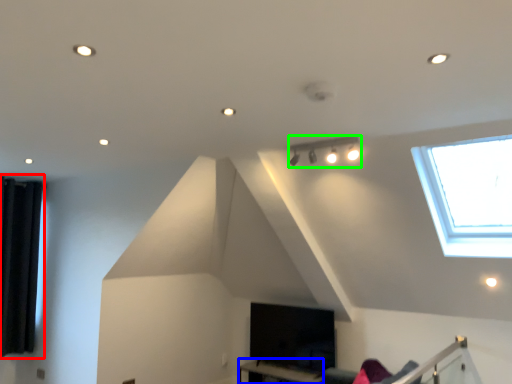
Question: Which is farther away from curtain (highlighted by a red box)? table (highlighted by a blue box) or lamp (highlighted by a green box)?

Choices:
 (A) table
 (B) lamp

Answer: (B)